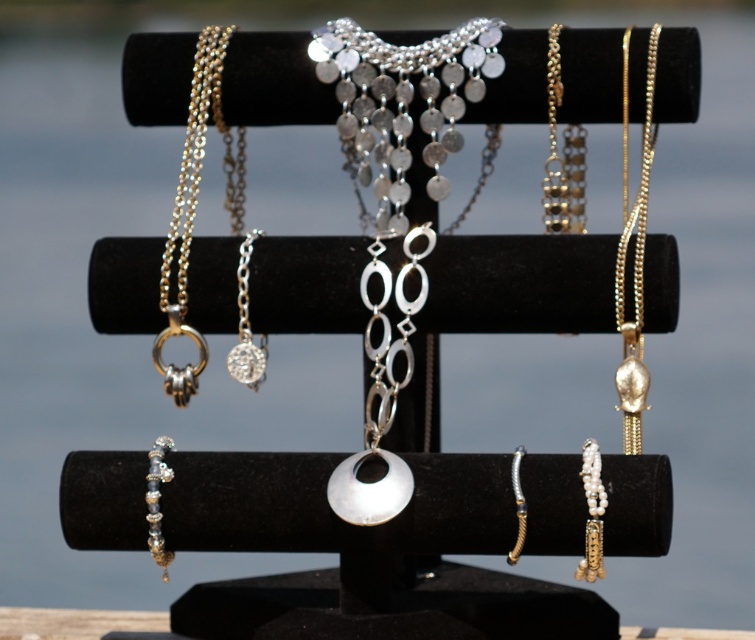
You are a customer at a jewelry store and want to choose between the gold chain link necklace at upper right and the gold textured bracelet at center. Based on their sizes, which one would you recommend if you prefer a larger piece?

The gold chain link necklace at upper right is larger in size than the gold textured bracelet at center, so it would be the better choice if you prefer a larger piece.